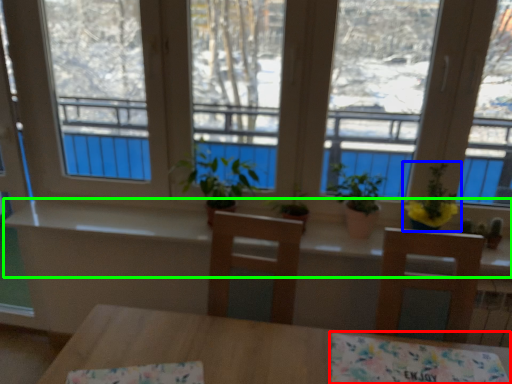
Question: Which object is the closest to the tablecloth (highlighted by a red box)? Choose among these: houseplant (highlighted by a blue box) or counter top (highlighted by a green box).

Choices:
 (A) houseplant
 (B) counter top

Answer: (A)